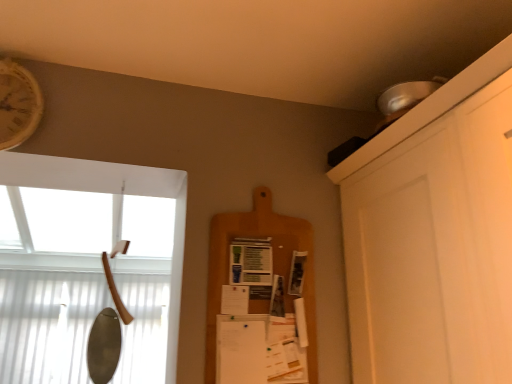
Question: Considering the relative positions of wooden axe handle at left and wooden clock at upper left in the image provided, is wooden axe handle at left to the left or to the right of wooden clock at upper left?

Choices:
 (A) left
 (B) right

Answer: (B)

Question: Is wooden axe handle at left wider or thinner than wooden clock at upper left?

Choices:
 (A) wide
 (B) thin

Answer: (A)

Question: Estimate the real-world distances between objects in this image. Which object is closer to the wooden axe handle at left?

Choices:
 (A) wooden clock at upper left
 (B) wooden cutting board at center

Answer: (A)

Question: Which object is positioned farthest from the wooden cutting board at center?

Choices:
 (A) wooden axe handle at left
 (B) wooden clock at upper left

Answer: (A)